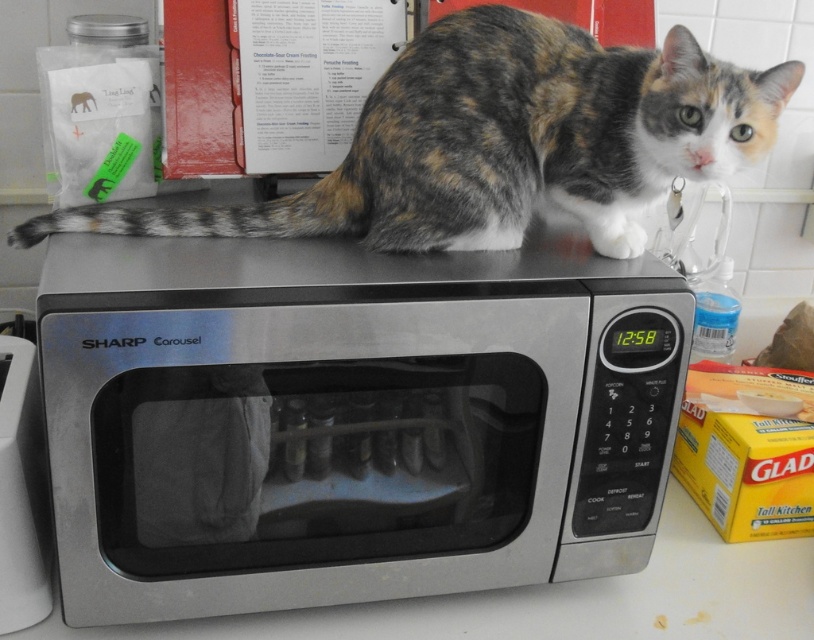
Find the location of a particular element. The height and width of the screenshot is (640, 814). satin silver microwave at upper center is located at coordinates (349, 419).

Is point (152, 346) behind point (33, 605)?

No, (152, 346) is closer to viewer.

Which is behind, point (344, 577) or point (38, 548)?

The point (344, 577) is more distant.

This screenshot has height=640, width=814. Identify the location of satin silver microwave at upper center. (349, 419).

Who is taller, satin silver microwave at upper center or calico fur cat at upper center?

satin silver microwave at upper center

Does satin silver microwave at upper center lie behind calico fur cat at upper center?

No, satin silver microwave at upper center is in front of calico fur cat at upper center.

Identify the location of satin silver microwave at upper center. coord(349,419).

In the scene shown: Does calico fur cat at upper center have a lesser height compared to satin silver microwave at center?

Correct, calico fur cat at upper center is not as tall as satin silver microwave at center.

What do you see at coordinates (501, 141) in the screenshot?
I see `calico fur cat at upper center` at bounding box center [501, 141].

You are a GUI agent. You are given a task and a screenshot of the screen. Output one action in this format:
    pyautogui.click(x=<x>, y=<y>)
    Task: Click on the calico fur cat at upper center
    
    Given the screenshot: What is the action you would take?
    pyautogui.click(x=501, y=141)